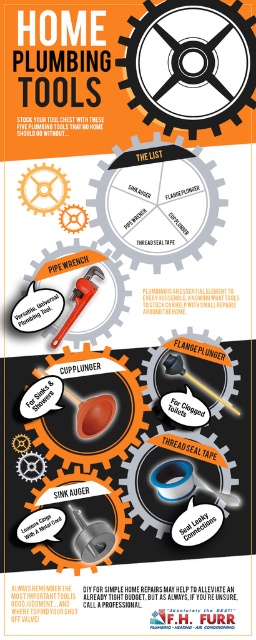
Between matte orange pipe wrench at center and matte black flange plunger at center, which one is positioned lower?

matte black flange plunger at center is below.

Does matte orange pipe wrench at center appear on the left side of matte black flange plunger at center?

Indeed, matte orange pipe wrench at center is positioned on the left side of matte black flange plunger at center.

Describe the element at coordinates (79, 300) in the screenshot. Image resolution: width=256 pixels, height=640 pixels. I see `matte orange pipe wrench at center` at that location.

Identify the location of matte orange pipe wrench at center. (79, 300).

Who is positioned more to the left, brushed metal sink auger at lower center or matte black flange plunger at center?

Positioned to the left is brushed metal sink auger at lower center.

Is brushed metal sink auger at lower center smaller than matte black flange plunger at center?

No, brushed metal sink auger at lower center is not smaller than matte black flange plunger at center.

Between point (195, 122) and point (192, 380), which one is positioned in front?

Point (195, 122)

Where is `brushed metal sink auger at lower center`? This screenshot has height=640, width=256. brushed metal sink auger at lower center is located at coordinates (189, 64).

Is point (206, 104) behind point (72, 401)?

That is False.

Which is above, brushed metal sink auger at lower center or orange rubber cup plunger at center?

brushed metal sink auger at lower center is above.

Does point (231, 68) lie behind point (80, 428)?

No, (231, 68) is in front of (80, 428).

Where is `brushed metal sink auger at lower center`? brushed metal sink auger at lower center is located at coordinates (189, 64).